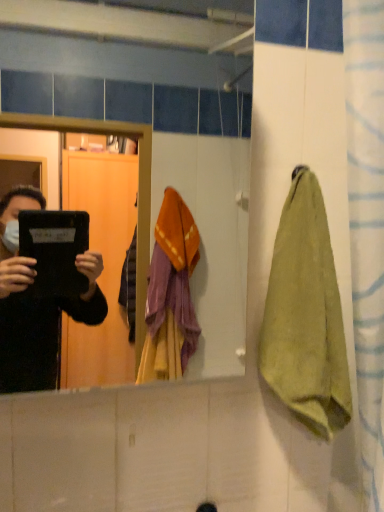
Question: Would you say green cotton towel at right is to the left or to the right of matte black tablet at center in the picture?

Choices:
 (A) right
 (B) left

Answer: (A)

Question: In terms of height, does green cotton towel at right look taller or shorter compared to matte black tablet at center?

Choices:
 (A) short
 (B) tall

Answer: (A)

Question: Relative to matte black tablet at center, is green cotton towel at right in front or behind?

Choices:
 (A) behind
 (B) front

Answer: (A)

Question: Is matte black tablet at center wider or thinner than green cotton towel at right?

Choices:
 (A) thin
 (B) wide

Answer: (B)

Question: From a real-world perspective, is matte black tablet at center physically located above or below green cotton towel at right?

Choices:
 (A) below
 (B) above

Answer: (B)

Question: Is point (243, 19) positioned closer to the camera than point (306, 404)?

Choices:
 (A) closer
 (B) farther

Answer: (B)

Question: From the image's perspective, is matte black tablet at center above or below green cotton towel at right?

Choices:
 (A) above
 (B) below

Answer: (A)